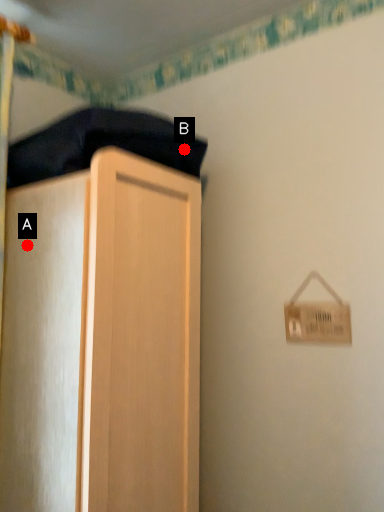
Question: Two points are circled on the image, labeled by A and B beside each circle. Among these points, which one is nearest to the camera?

Choices:
 (A) A is closer
 (B) B is closer

Answer: (A)